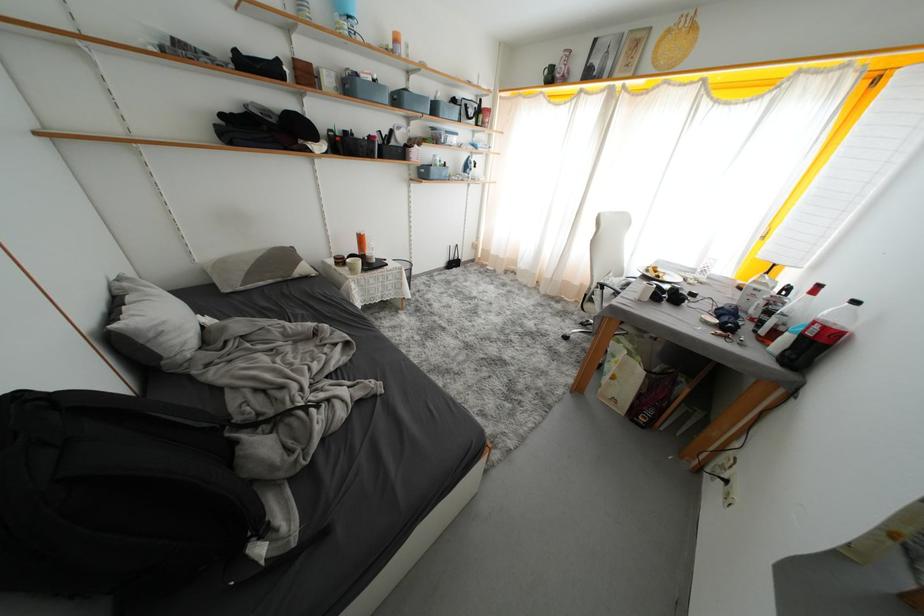
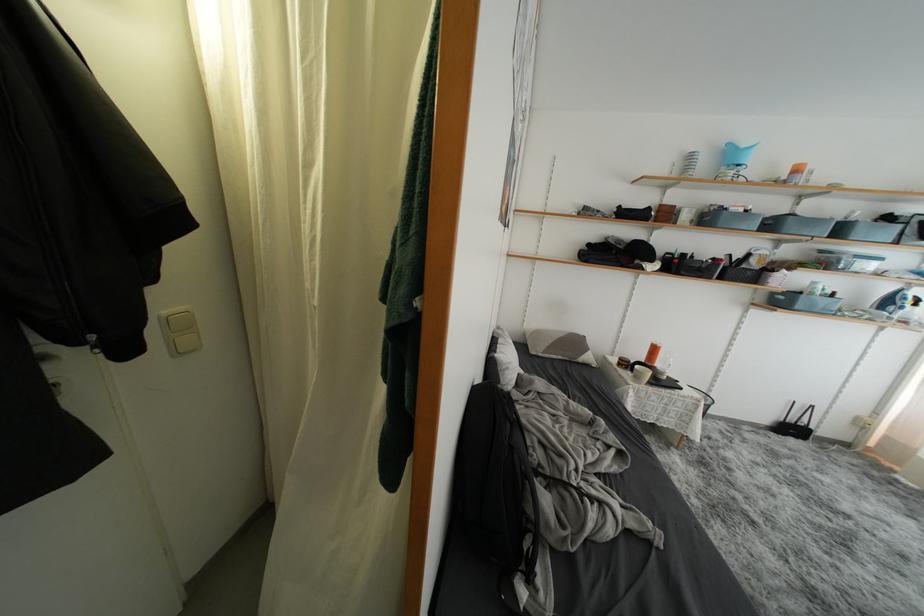
In the second image, find the point that corresponds to pixel 404 103 in the first image.

(777, 229)